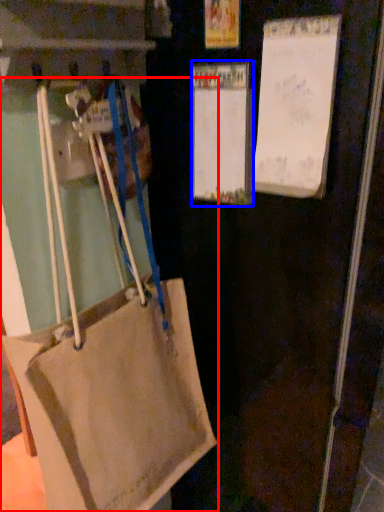
Question: Which point is further to the camera, handbag (highlighted by a red box) or bulletin board (highlighted by a blue box)?

Choices:
 (A) handbag
 (B) bulletin board

Answer: (B)